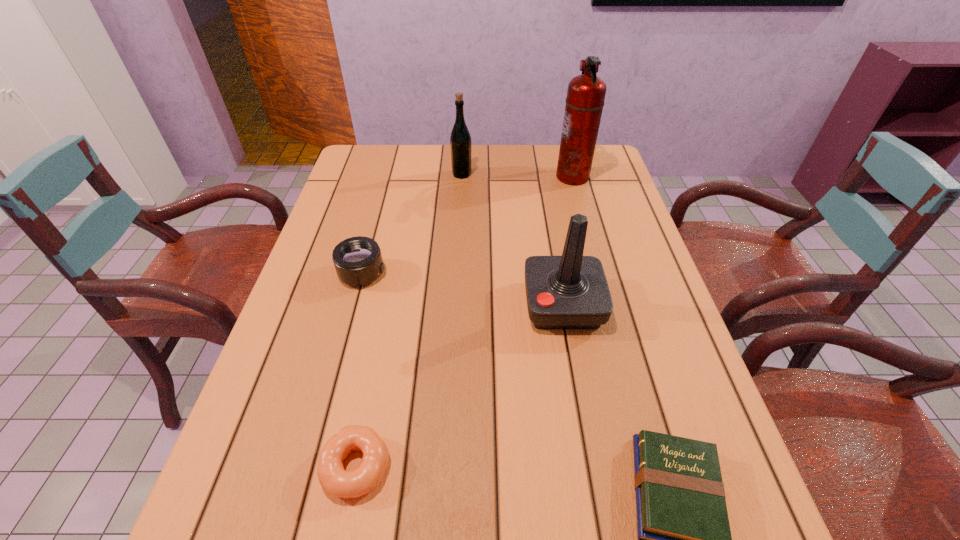
Find the location of `free point located on the side of the third shortest object with brand markings and control switches`. free point located on the side of the third shortest object with brand markings and control switches is located at coordinates (473, 273).

The height and width of the screenshot is (540, 960). What are the coordinates of `free location located on the right of the doughnut` in the screenshot? It's located at (608, 467).

Locate an element on the screen. This screenshot has width=960, height=540. fire extinguisher positioned at the far edge is located at coordinates (586, 93).

In order to click on beer bottle that is at the far edge in this screenshot , I will do `click(460, 140)`.

At what (x,y) coordinates should I click in order to perform the action: click on object positioned at the left edge. Please return your answer as a coordinate pair (x, y). The height and width of the screenshot is (540, 960). Looking at the image, I should click on (358, 261).

Find the location of `fire extinguisher located in the right edge section of the desktop`. fire extinguisher located in the right edge section of the desktop is located at coordinates (586, 93).

Locate an element on the screen. The width and height of the screenshot is (960, 540). joystick positioned at the right edge is located at coordinates (571, 291).

Identify the location of object positioned at the far right corner. Image resolution: width=960 pixels, height=540 pixels. (586, 93).

You are a GUI agent. You are given a task and a screenshot of the screen. Output one action in this format:
    pyautogui.click(x=<x>, y=<y>)
    Task: Click on the vacant space at the far edge of the desktop
    The image size is (960, 540).
    Given the screenshot: What is the action you would take?
    pyautogui.click(x=505, y=168)

This screenshot has width=960, height=540. In the image, there is a desktop. What are the coordinates of `vacant space at the near edge` in the screenshot? It's located at (582, 535).